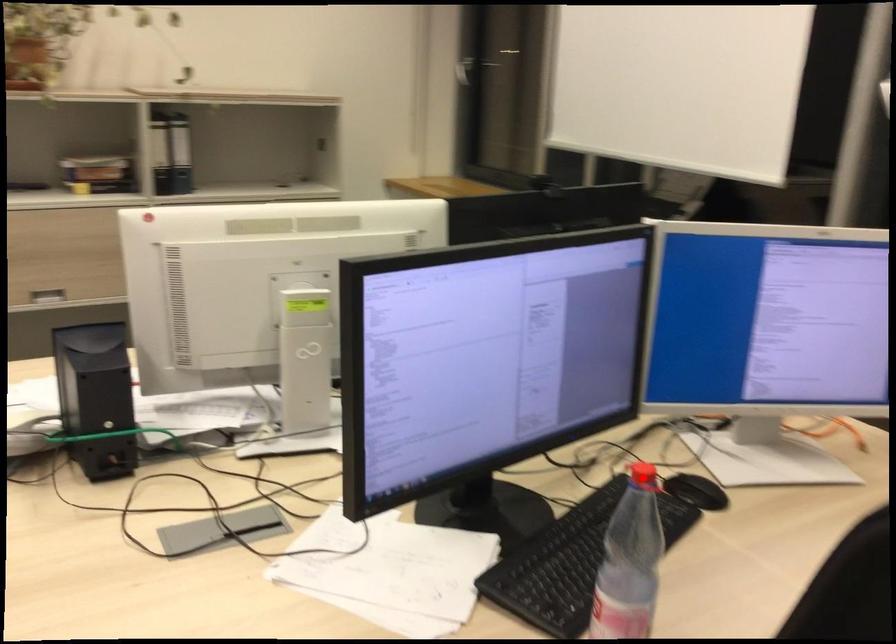
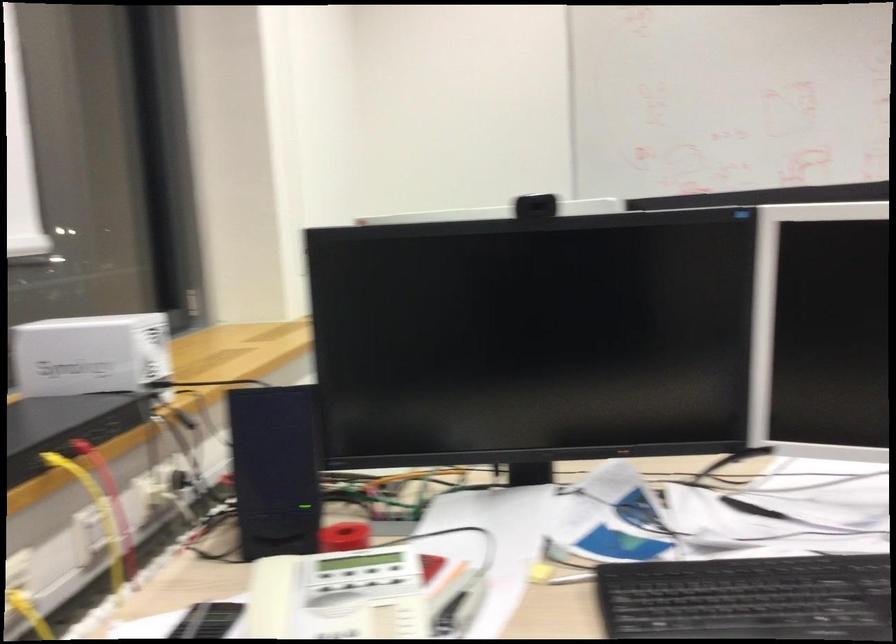
Question: I am providing you with two images of the same scene from different viewpoints. A red point is marked on the first image. At the location where the point appears in image 1, is it still visible in image 2?

Choices:
 (A) Yes
 (B) No

Answer: (B)